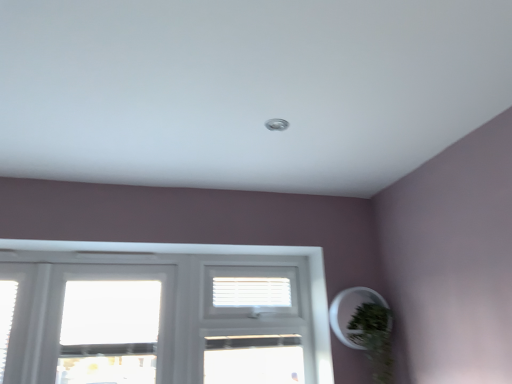
Question: Does white plastic blinds at center appear on the right side of white plastic screen door at center?

Choices:
 (A) yes
 (B) no

Answer: (A)

Question: Can you confirm if white plastic blinds at center is taller than white plastic screen door at center?

Choices:
 (A) no
 (B) yes

Answer: (A)

Question: Is white plastic blinds at center positioned in front of white plastic screen door at center?

Choices:
 (A) no
 (B) yes

Answer: (A)

Question: Does white plastic blinds at center come behind white plastic screen door at center?

Choices:
 (A) yes
 (B) no

Answer: (A)

Question: Considering the relative sizes of white plastic blinds at center and white plastic screen door at center in the image provided, is white plastic blinds at center bigger than white plastic screen door at center?

Choices:
 (A) yes
 (B) no

Answer: (B)

Question: From a real-world perspective, is white plastic blinds at center on top of white plastic screen door at center?

Choices:
 (A) yes
 (B) no

Answer: (A)

Question: Is white plastic screen door at center smaller than green matte plant at lower right?

Choices:
 (A) yes
 (B) no

Answer: (B)

Question: Would you consider white plastic screen door at center to be distant from green matte plant at lower right?

Choices:
 (A) no
 (B) yes

Answer: (A)

Question: Considering the relative sizes of white plastic screen door at center and green matte plant at lower right in the image provided, is white plastic screen door at center taller than green matte plant at lower right?

Choices:
 (A) no
 (B) yes

Answer: (B)

Question: Considering the relative sizes of white plastic screen door at center and green matte plant at lower right in the image provided, is white plastic screen door at center shorter than green matte plant at lower right?

Choices:
 (A) yes
 (B) no

Answer: (B)

Question: Does white plastic screen door at center have a lesser width compared to green matte plant at lower right?

Choices:
 (A) yes
 (B) no

Answer: (A)

Question: Does white plastic screen door at center come behind green matte plant at lower right?

Choices:
 (A) no
 (B) yes

Answer: (B)

Question: Does white plastic blinds at center appear on the right side of green matte plant at lower right?

Choices:
 (A) yes
 (B) no

Answer: (B)